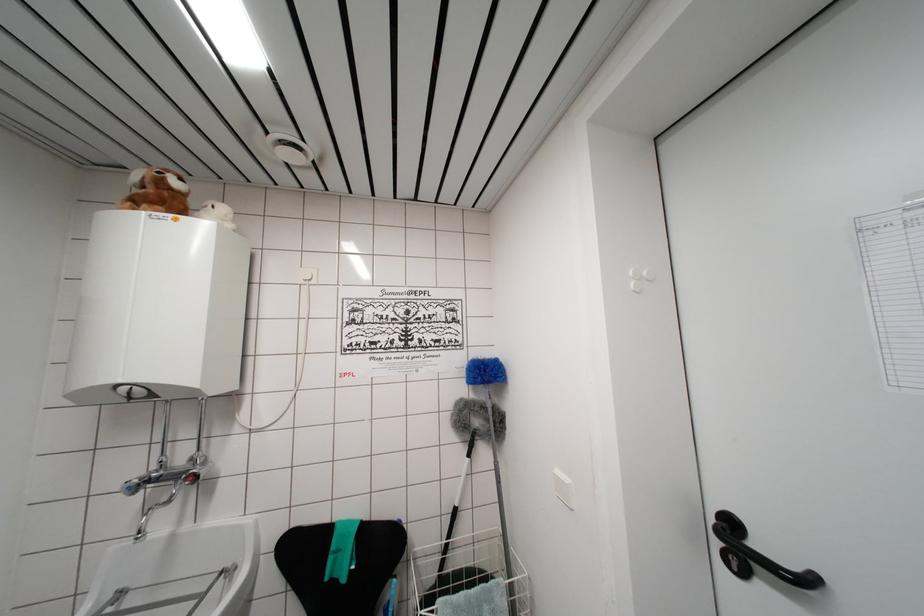
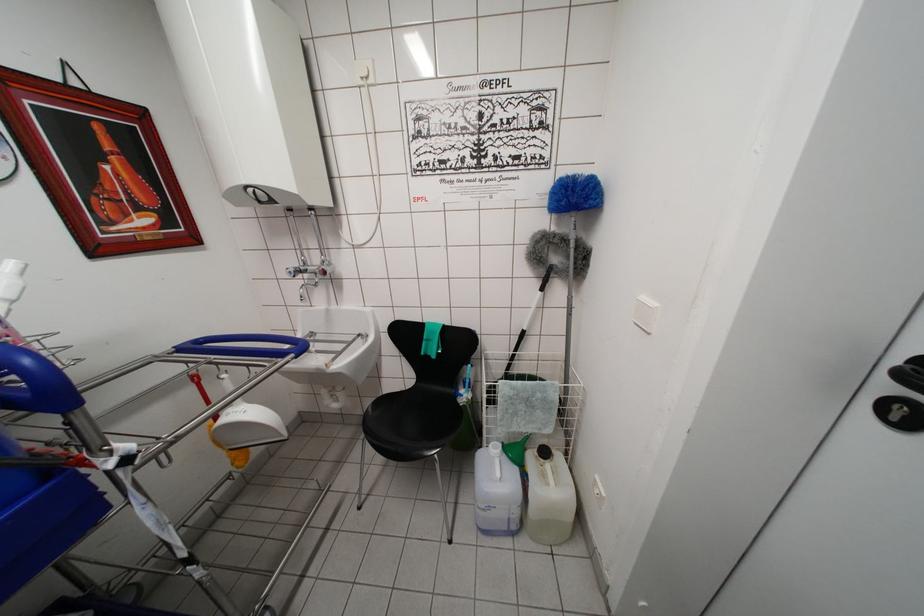
Find the pixel in the second image that matches the point at 492,426 in the first image.

(572, 261)